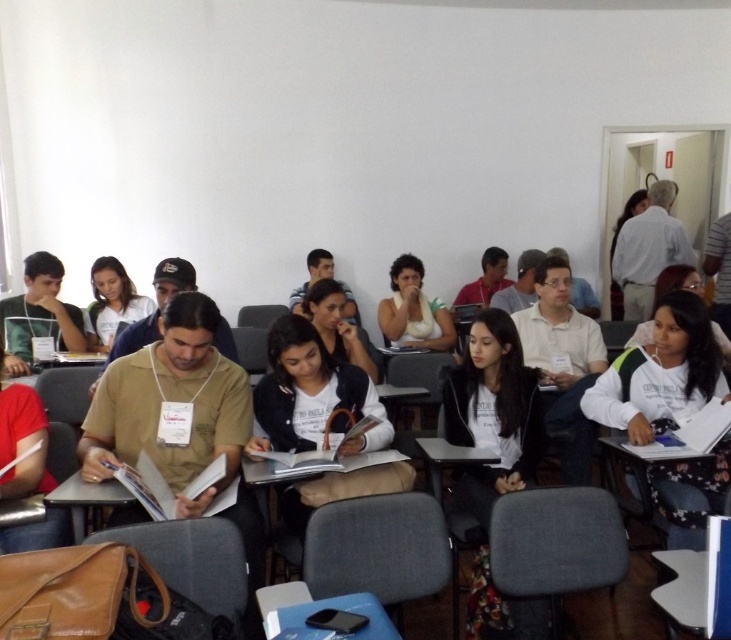
Does white cotton shirt at lower right have a smaller size compared to white plastic table at lower right?

Incorrect, white cotton shirt at lower right is not smaller in size than white plastic table at lower right.

Measure the distance between point (678, 525) and camera.

Point (678, 525) is 2.40 meters from camera.

Identify the location of white cotton shirt at lower right. The width and height of the screenshot is (731, 640). (662, 372).

Describe the element at coordinates (683, 588) in the screenshot. I see `white plastic table at lower right` at that location.

Can you confirm if white plastic table at lower right is positioned above white plastic table at lower center?

Indeed, white plastic table at lower right is positioned over white plastic table at lower center.

Which is behind, point (727, 634) or point (371, 621)?

Point (727, 634)

Where is `white plastic table at lower right`? The width and height of the screenshot is (731, 640). white plastic table at lower right is located at coordinates (683, 588).

Can you confirm if white cotton shirt at lower right is positioned to the left of white plastic table at lower center?

No, white cotton shirt at lower right is not to the left of white plastic table at lower center.

Is point (621, 412) in front of point (300, 604)?

No, it is behind (300, 604).

Between point (666, 362) and point (367, 611), which one is positioned in front?

Point (367, 611)

Image resolution: width=731 pixels, height=640 pixels. I want to click on white cotton shirt at lower right, so click(662, 372).